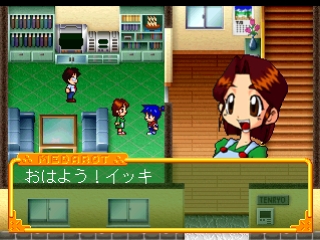
Identify the location of wall. The image size is (320, 240). (201, 37).